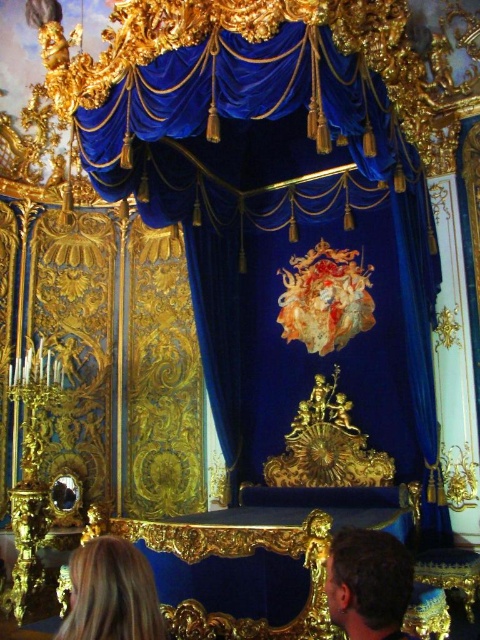
You are standing in the grand room and want to greet both people with blonde hair at lower left and brown hair at lower right. Which person should you approach first to be polite?

You should approach the blonde hair at lower left first because they are closer to you than the brown hair at lower right, so it is more polite to greet them first.

You are a guest in this grand room and want to greet the person with blonde hair at lower left. Where should you walk to approach them?

The blonde hair at lower left is located at point (x=111, y=593), so you should walk towards the lower left direction to approach them.

From the picture: You are an interior designer assessing the placement of furniture in this grand room. The coordinates given are part of an object in the scene. Which object is located at the coordinates point (x=111, y=593)?

The point (x=111, y=593) corresponds to the blonde hair at lower left.